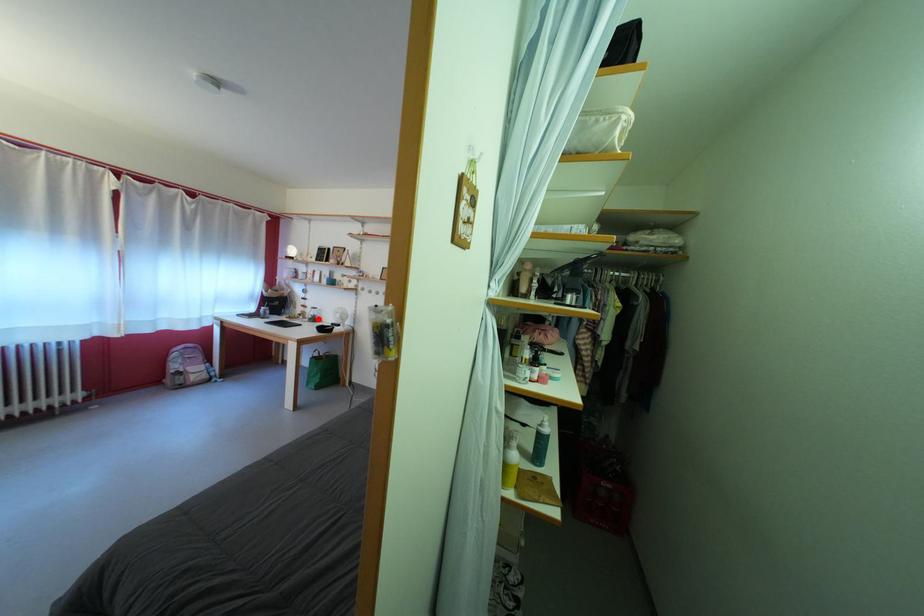
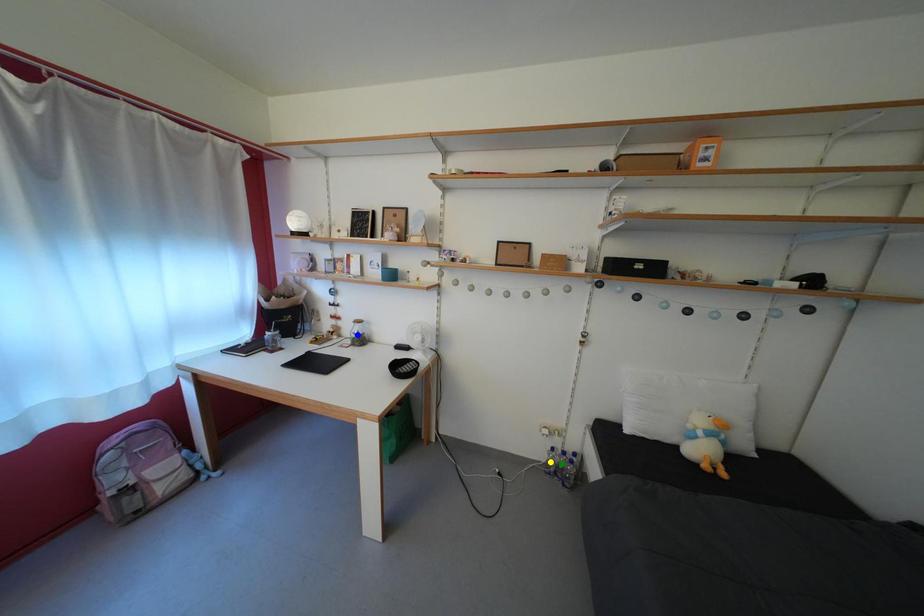
Question: I am providing you with two images of the same scene from different viewpoints. A red point is marked on the first image. You are given multiple points on the second image. Which point in image 2 represents the same 3d spot as the red point in image 1?

Choices:
 (A) yellow point
 (B) blue point
 (C) green point

Answer: (B)